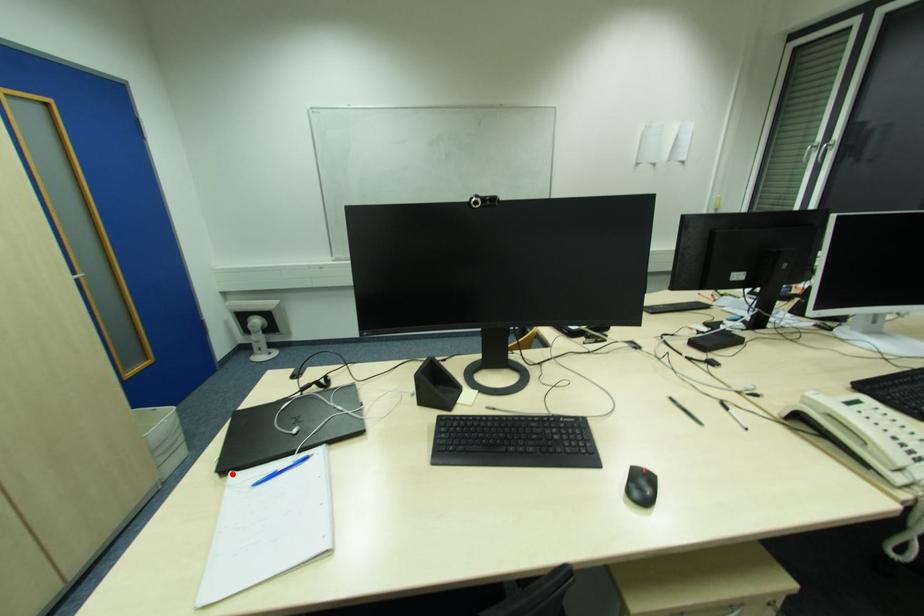
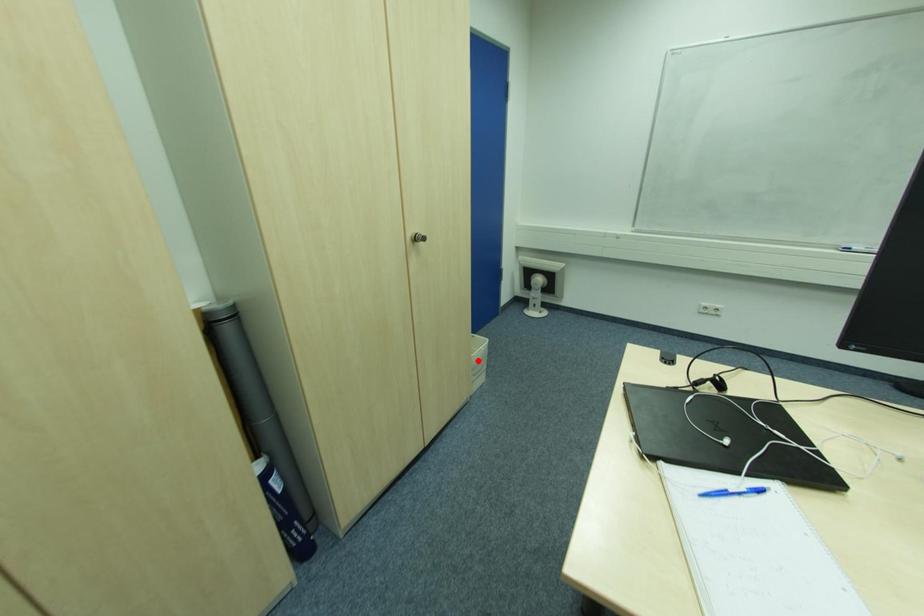
I am providing you with two images of the same scene from different viewpoints. A red point is marked on the first image and another point is marked on the second image. Are the points marked in image1 and image2 representing the same 3D position?

No